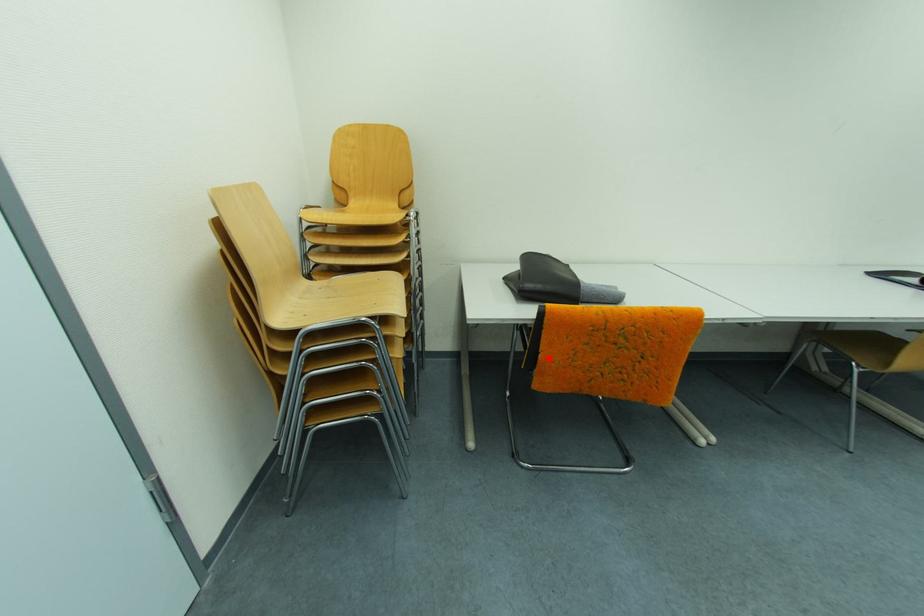
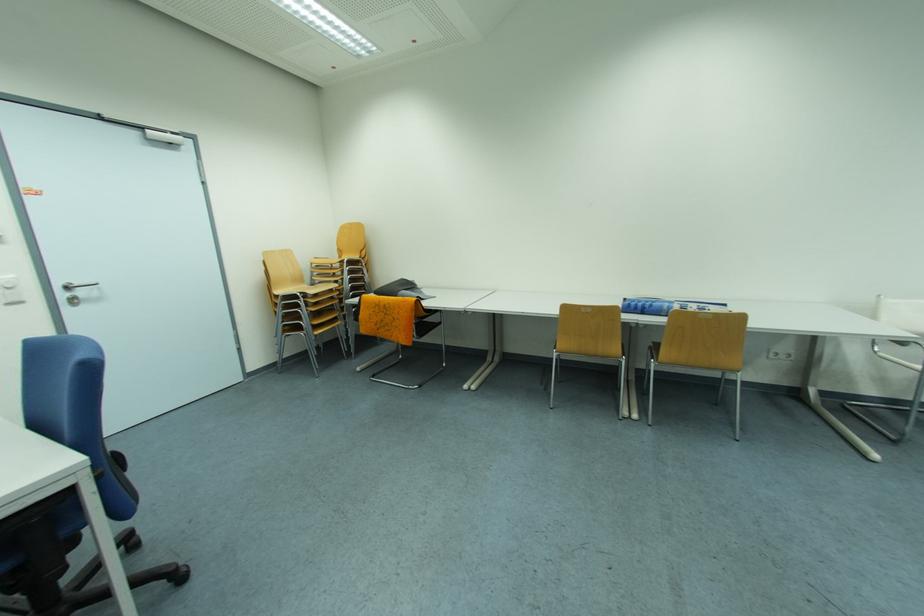
Question: A red point is marked in image1. In image2, is the corresponding 3D point closer to the camera or farther? Reply with the corresponding letter.

Choices:
 (A) The corresponding 3D point is closer.
 (B) The corresponding 3D point is farther.

Answer: (B)